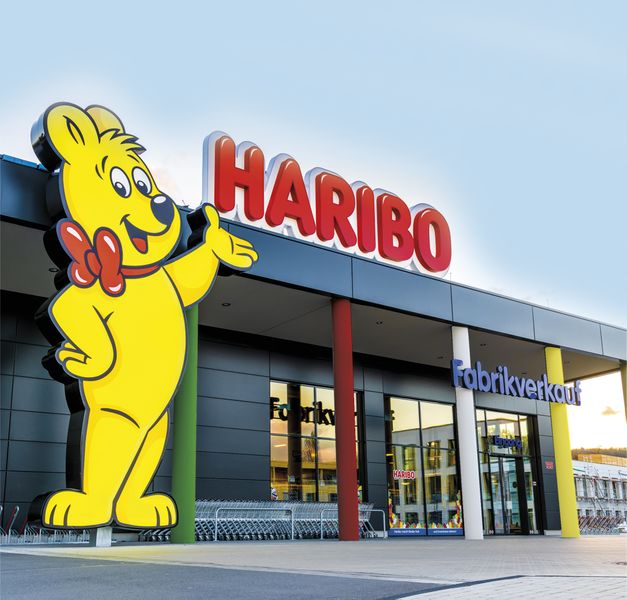
Locate an element on the screen. green pillar is located at coordinates (185, 447).